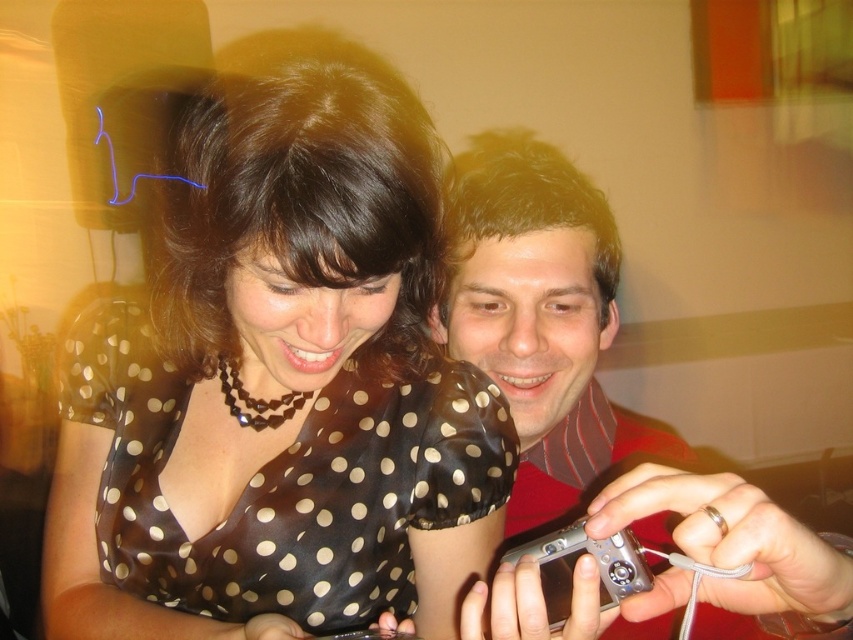
The width and height of the screenshot is (853, 640). What do you see at coordinates (277, 381) in the screenshot?
I see `black satin blouse at center` at bounding box center [277, 381].

Between point (103, 424) and point (601, 506), which one is positioned in front?

Positioned in front is point (601, 506).

This screenshot has height=640, width=853. What do you see at coordinates (277, 381) in the screenshot?
I see `black satin blouse at center` at bounding box center [277, 381].

Where is `black satin blouse at center`? This screenshot has width=853, height=640. black satin blouse at center is located at coordinates (277, 381).